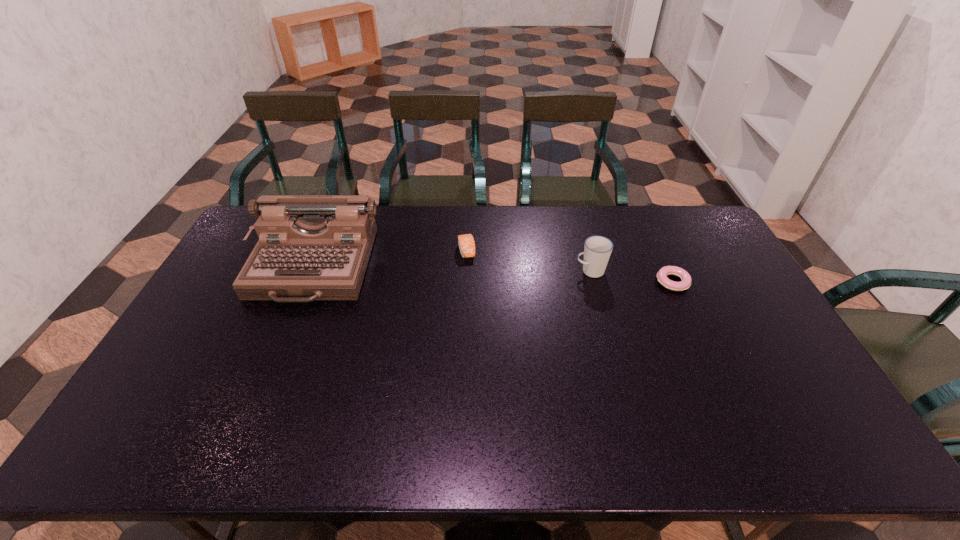
Image resolution: width=960 pixels, height=540 pixels. Identify the location of vacant space that satisfies the following two spatial constraints: 1. on the front side of the rightmost object; 2. on the right side of the sushi. (466, 282).

Where is `vacant space that satisfies the following two spatial constraints: 1. on the keyboard of the leftmost object; 2. on the left side of the rightmost object`? The width and height of the screenshot is (960, 540). vacant space that satisfies the following two spatial constraints: 1. on the keyboard of the leftmost object; 2. on the left side of the rightmost object is located at coordinates (305, 282).

You are a GUI agent. You are given a task and a screenshot of the screen. Output one action in this format:
    pyautogui.click(x=<x>, y=<y>)
    Task: Click on the vacant area that satisfies the following two spatial constraints: 1. with a handle on the side of the cup; 2. on the right side of the shortest object
    
    Given the screenshot: What is the action you would take?
    pyautogui.click(x=593, y=282)

The image size is (960, 540). In order to click on vacant space that satisfies the following two spatial constraints: 1. on the keyboard of the leftmost object; 2. on the right side of the rightmost object in this screenshot , I will do `click(305, 282)`.